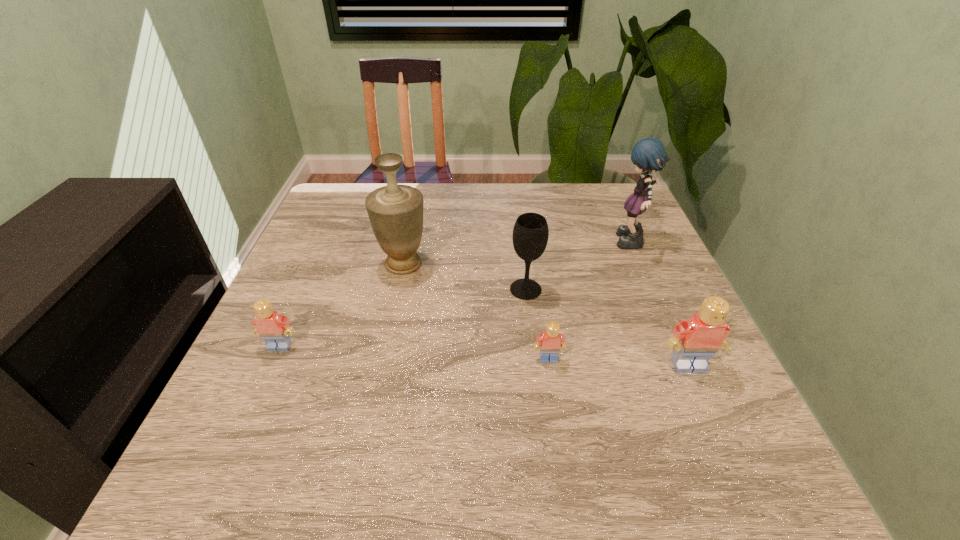
This screenshot has width=960, height=540. Find the location of `free space at the near edge`. free space at the near edge is located at coordinates (460, 422).

The height and width of the screenshot is (540, 960). What are the coordinates of `free space at the left edge of the desktop` in the screenshot? It's located at (267, 378).

At what (x,y) coordinates should I click in order to perform the action: click on free space at the right edge of the desktop. Please return your answer as a coordinate pair (x, y). This screenshot has width=960, height=540. Looking at the image, I should click on (617, 252).

Image resolution: width=960 pixels, height=540 pixels. I want to click on vacant area at the far left corner, so click(x=353, y=219).

Where is `free area in between the shortest Lego and the wineglass`? free area in between the shortest Lego and the wineglass is located at coordinates (537, 324).

I want to click on empty space that is in between the urn and the shortest object, so click(x=476, y=312).

Image resolution: width=960 pixels, height=540 pixels. What are the coordinates of `empty space that is in between the shortest object and the rag doll` in the screenshot? It's located at (589, 301).

Image resolution: width=960 pixels, height=540 pixels. I want to click on vacant space in between the tallest Lego and the second shortest object, so click(484, 356).

Identify the location of vacant space that is in between the fifth tallest object and the rag doll. (455, 295).

Find the location of a particular element. This screenshot has width=960, height=540. vacant area that lies between the wineglass and the shortest Lego is located at coordinates (537, 324).